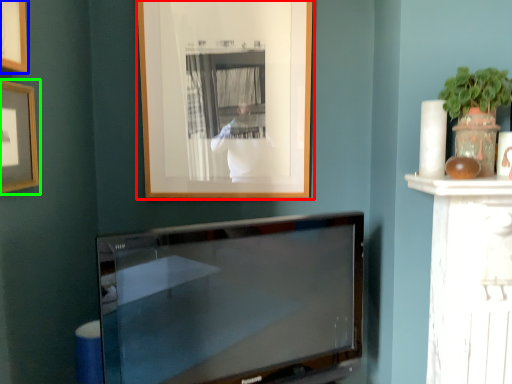
Question: Considering the real-world distances, which object is farthest from picture frame (highlighted by a red box)? picture frame (highlighted by a blue box) or picture frame (highlighted by a green box)?

Choices:
 (A) picture frame
 (B) picture frame

Answer: (A)